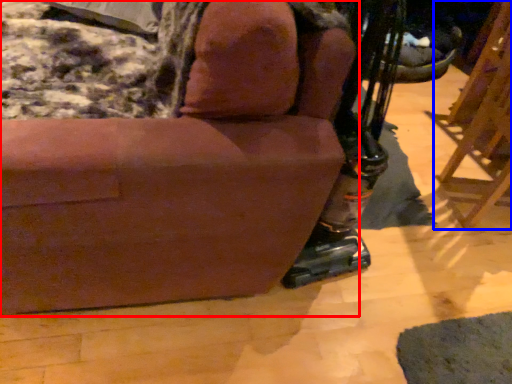
Question: Which point is closer to the camera, chair (highlighted by a red box) or furniture (highlighted by a blue box)?

Choices:
 (A) chair
 (B) furniture

Answer: (A)